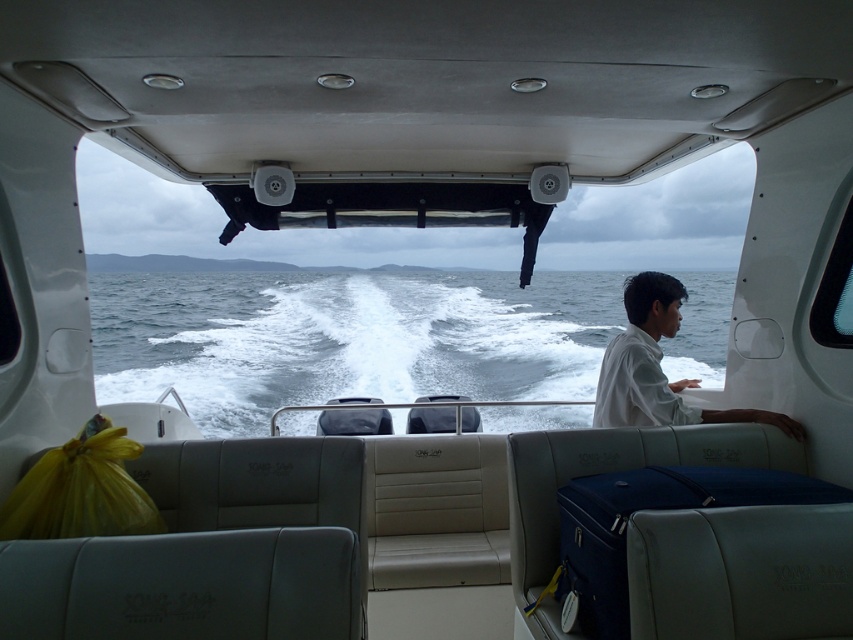
You are a photographer trying to capture the scene from the boat. You notice the white foamy water at center and the white matte shirt at right. Which object would you focus on if you want to capture the larger subject in your shot?

The white foamy water at center is bigger than the white matte shirt at right, so focusing on the white foamy water at center would capture the larger subject.